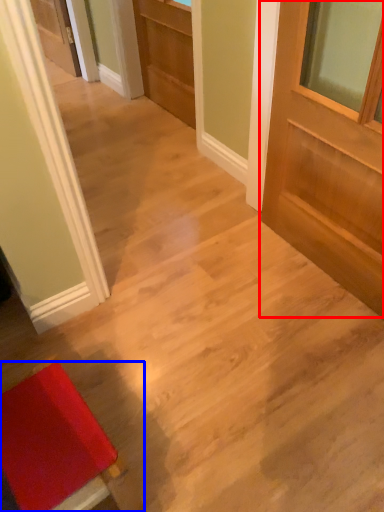
Question: Which object appears farthest to the camera in this image, door (highlighted by a red box) or furniture (highlighted by a blue box)?

Choices:
 (A) door
 (B) furniture

Answer: (A)